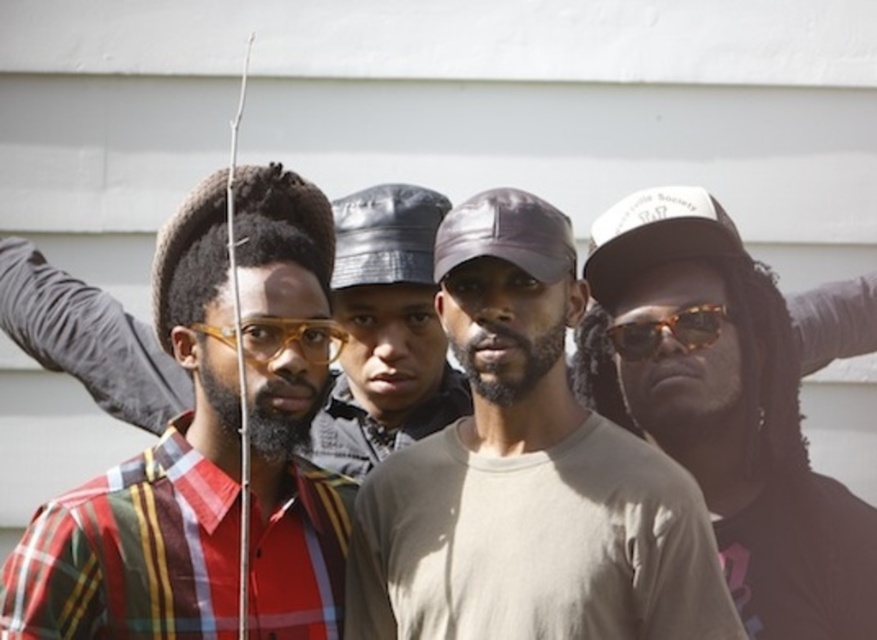
Does brown leather cap at center have a greater width compared to matte black baseball cap at left?

Yes, brown leather cap at center is wider than matte black baseball cap at left.

Which is in front, point (700, 429) or point (298, 253)?

Point (298, 253) is in front.

Locate an element on the screen. brown leather cap at center is located at coordinates (732, 410).

Does point (203, 358) lie in front of point (330, 468)?

Yes, it is.

Can you confirm if plaid fabric shirt at left is shorter than matte black cap at center?

In fact, plaid fabric shirt at left may be taller than matte black cap at center.

Between point (305, 198) and point (362, 220), which one is positioned behind?

Positioned behind is point (362, 220).

Locate an element on the screen. The image size is (877, 640). plaid fabric shirt at left is located at coordinates (151, 483).

Is point (403, 435) less distant than point (711, 216)?

No, it is not.

Is point (432, 403) closer to camera compared to point (589, 244)?

No.

You are a GUI agent. You are given a task and a screenshot of the screen. Output one action in this format:
    pyautogui.click(x=<x>, y=<y>)
    Task: Click on the matte black cap at center
    The width and height of the screenshot is (877, 640).
    Given the screenshot: What is the action you would take?
    pyautogui.click(x=386, y=332)